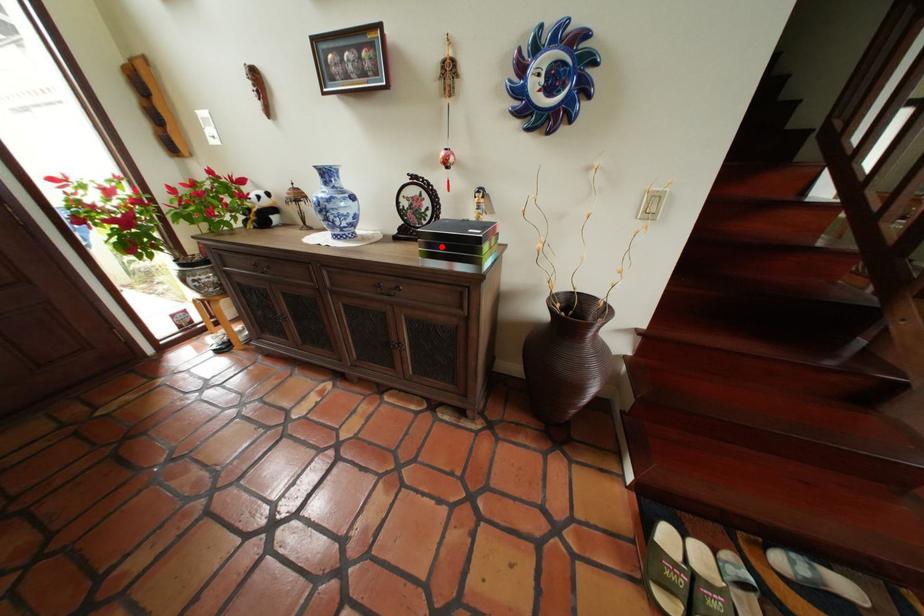
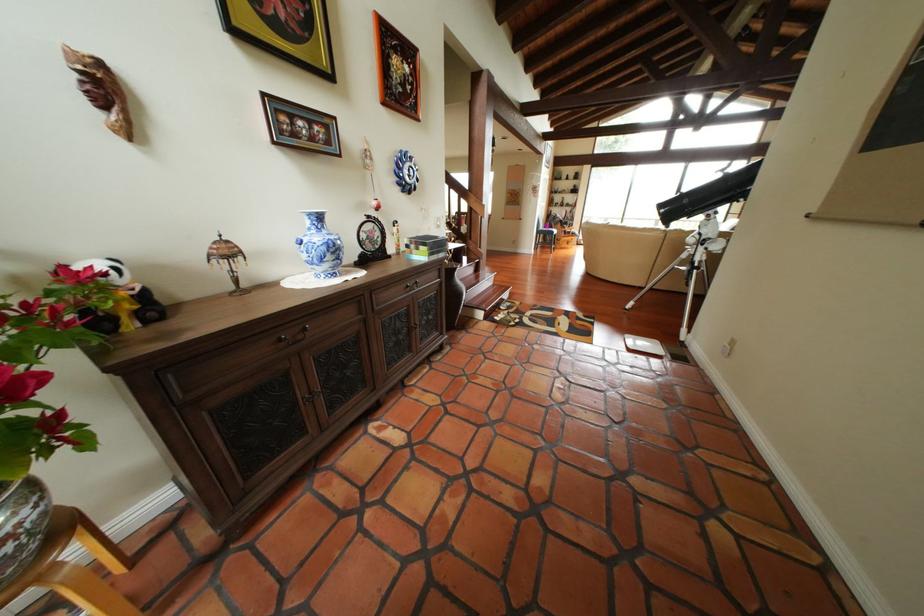
Find the pixel in the second image that matches the highlighted location in the first image.

(444, 249)